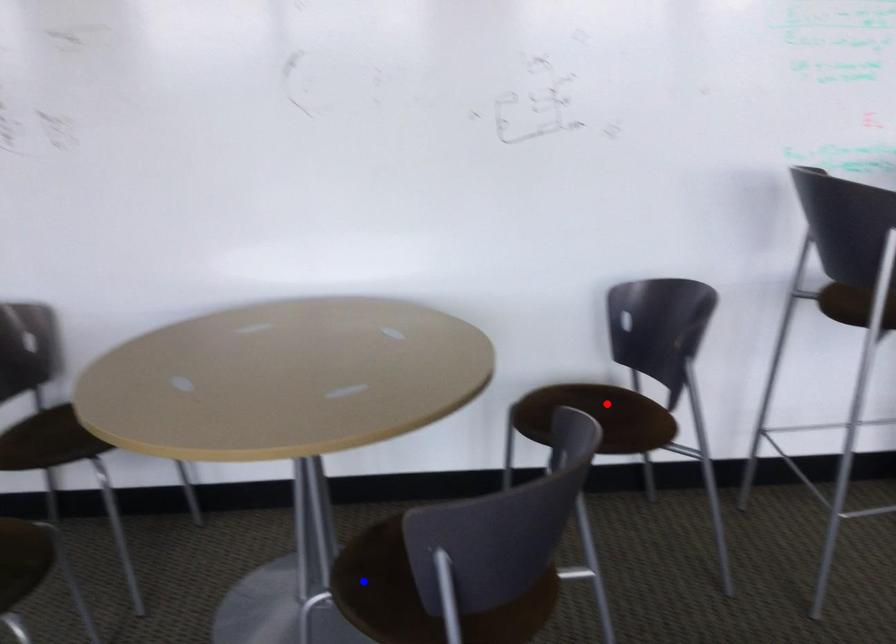
Question: Which of the two points in the image is closer to the camera?

Choices:
 (A) Blue point is closer.
 (B) Red point is closer.

Answer: (A)